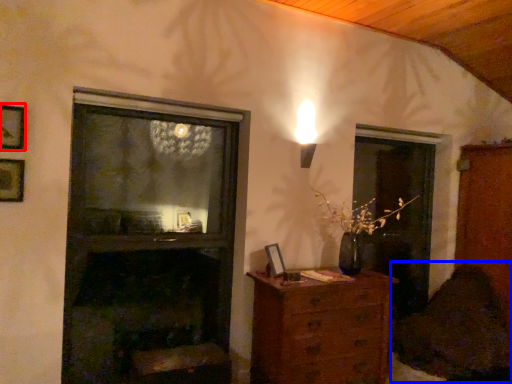
Question: Which point is closer to the camera, picture frame (highlighted by a red box) or swivel chair (highlighted by a blue box)?

Choices:
 (A) picture frame
 (B) swivel chair

Answer: (A)